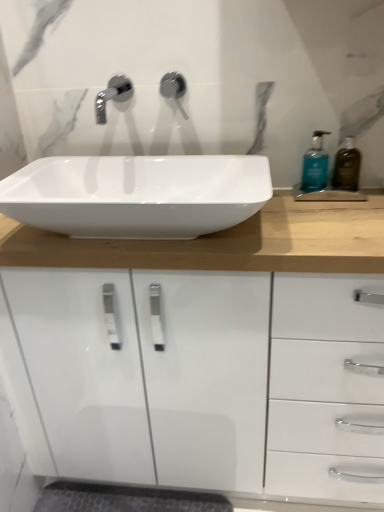
Question: Is translucent amber bottle at right, marked as the 2th soap dispenser in a left-to-right arrangement, situated inside teal glass soap dispenser at right, the first soap dispenser positioned from the left, or outside?

Choices:
 (A) inside
 (B) outside

Answer: (B)

Question: Does point (352, 165) appear closer or farther from the camera than point (322, 163)?

Choices:
 (A) closer
 (B) farther

Answer: (A)

Question: Which of these objects is positioned closest to the translucent amber bottle at right, marked as the 2th soap dispenser in a left-to-right arrangement?

Choices:
 (A) teal glass soap dispenser at right, the first soap dispenser positioned from the left
 (B) matte silver faucet at upper center
 (C) white glossy sink at center

Answer: (A)

Question: Based on their relative distances, which object is farther from the teal glass soap dispenser at right, the second soap dispenser positioned from the right?

Choices:
 (A) translucent amber bottle at right, marked as the 2th soap dispenser in a left-to-right arrangement
 (B) matte silver faucet at upper center
 (C) white glossy sink at center

Answer: (C)